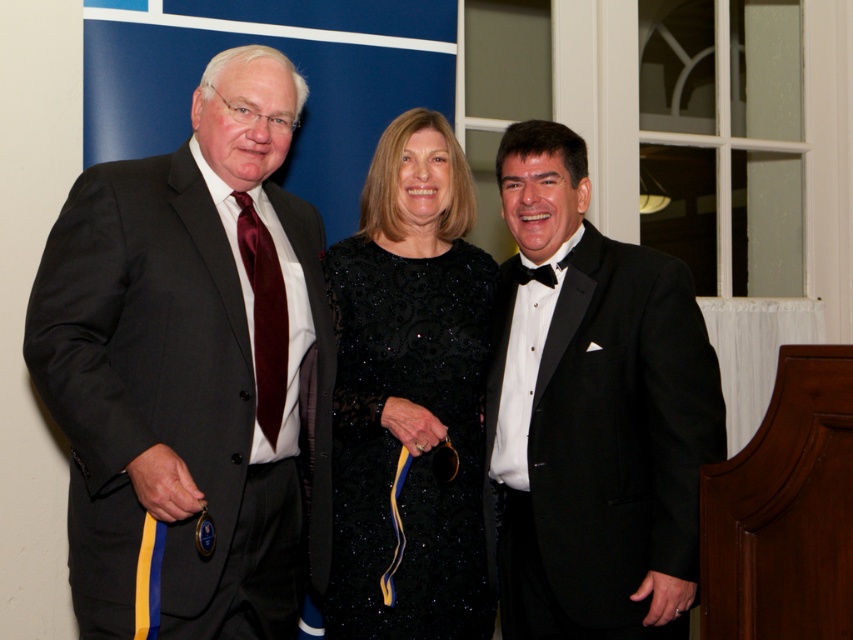
You are a photographer setting up for a formal event. You need to arrange two outfits on a mannequin stand. The black satin tuxedo at right and the black sequined dress at center must be displayed side by side. Given that the mannequin stand is 1.8 meters tall, will both outfits fit without needing adjustments?

The black satin tuxedo at right is taller than the black sequined dress at center. Since the mannequin stand is 1.8 meters tall, both outfits can fit as the tuxedo being the taller one would still be within the stand height.

You are a photographer setting up for a group photo. You notice the matte black suit at left and the black sequined dress at center. Which one is positioned nearer to you?

The matte black suit at left is closer to the viewer than the black sequined dress at center.

You are organizing a formal event and need to arrange seating based on the guests clothing widths. Given the matte black suit at left and the black satin tuxedo at right, which guest should have a wider seat? Please base your answer on the clothing width.

The matte black suit at left is wider than the black satin tuxedo at right, so the guest wearing the matte black suit at left requires a wider seat.